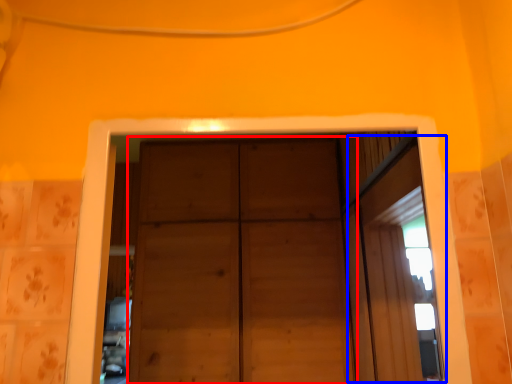
Question: Which point is closer to the camera, door (highlighted by a red box) or window (highlighted by a blue box)?

Choices:
 (A) door
 (B) window

Answer: (B)